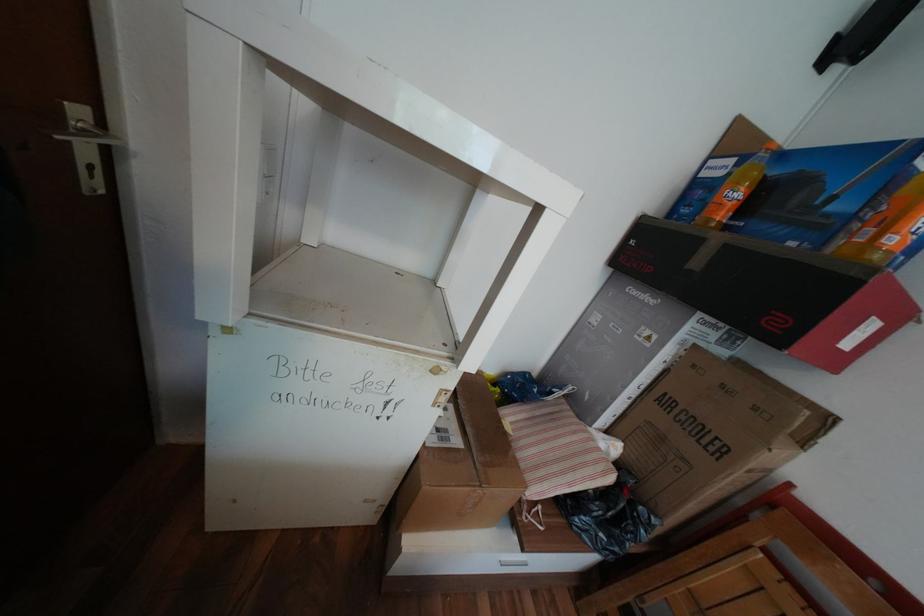
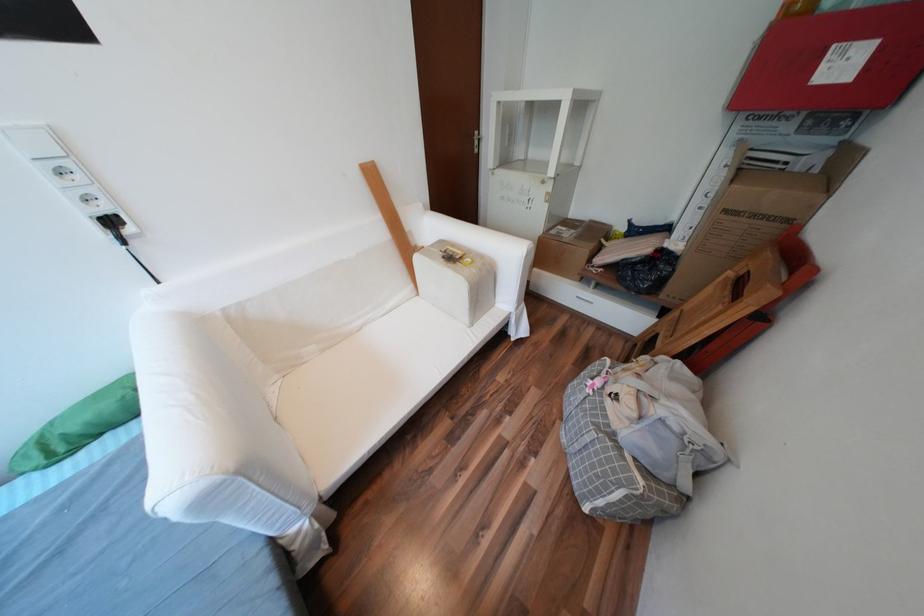
Where in the second image is the point corresponding to (758,471) from the first image?

(736, 211)